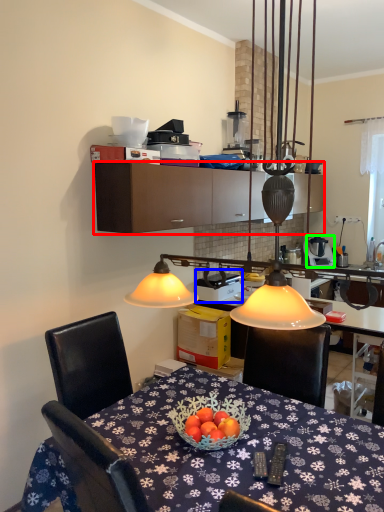
Question: Which object is positioned closest to cabinetry (highlighted by a red box)? Select from appliance (highlighted by a blue box) and appliance (highlighted by a green box).

Choices:
 (A) appliance
 (B) appliance

Answer: (A)